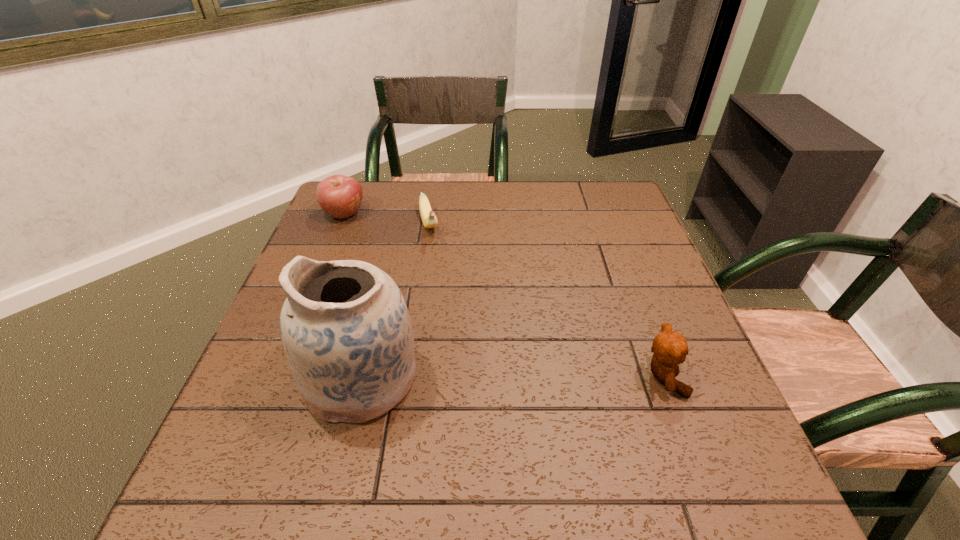
Where is `free spot on the desktop that is between the tallest object and the teddy bear and is positioned at the stem of the banana`? This screenshot has height=540, width=960. free spot on the desktop that is between the tallest object and the teddy bear and is positioned at the stem of the banana is located at coordinates (478, 377).

What are the coordinates of `vacant spot on the desktop that is between the pottery and the teddy bear and is positioned on the side of the apple with the unique marking` in the screenshot? It's located at (514, 377).